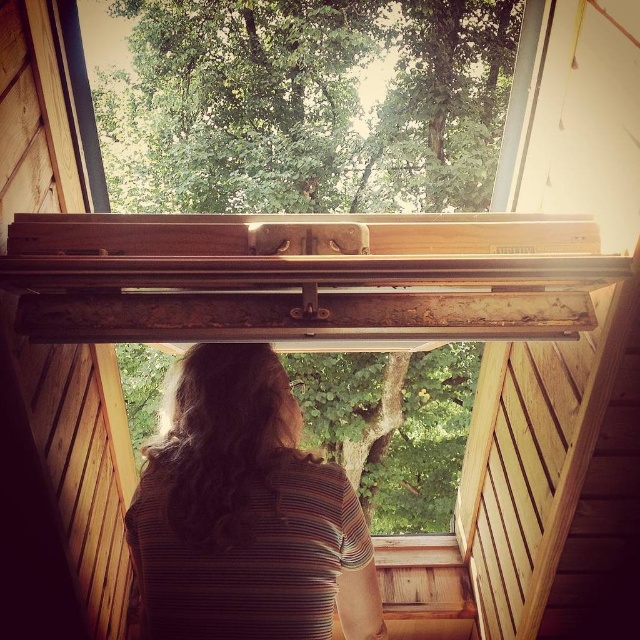
You are a painter standing in the cabin and want to paint both the green leafy tree at upper center and the brown striped shirt at center. You have a canvas that can only capture objects within 5 meters of each other. Can you paint both on the same canvas?

The green leafy tree at upper center and brown striped shirt at center are 6.78 meters apart from each other, which exceeds the 5 meter limit. Therefore, you cannot paint both on the same canvas.

You are an interior designer planning to hang a large painting above a sofa. You observe the green leafy tree at upper center and the brown striped shirt at center in the room. Based on their sizes, which object would be more suitable as a focal point for the wall space above the sofa?

The green leafy tree at upper center is larger in size compared to the brown striped shirt at center, making it a better choice as a focal point for the wall space above the sofa.